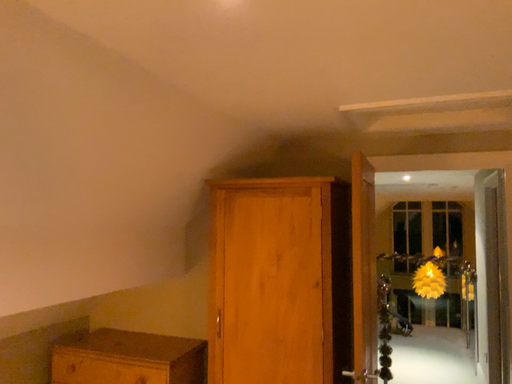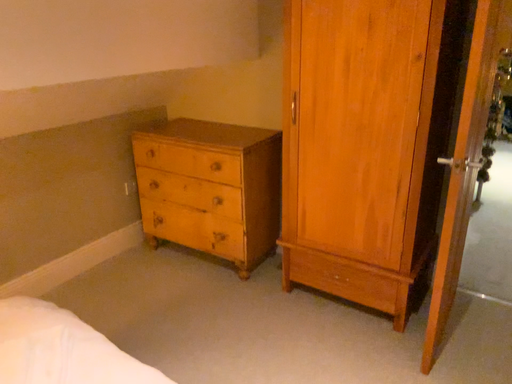
Question: Which way did the camera rotate in the video?

Choices:
 (A) rotated left
 (B) rotated right

Answer: (A)